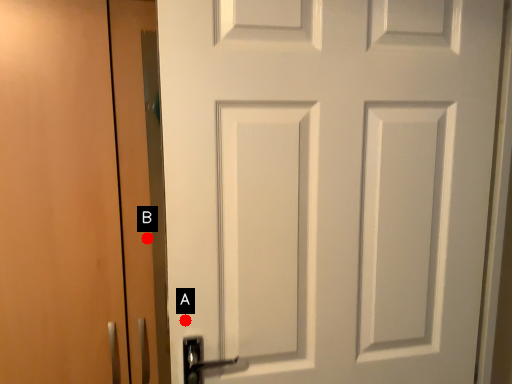
Question: Two points are circled on the image, labeled by A and B beside each circle. Which point is closer to the camera?

Choices:
 (A) A is closer
 (B) B is closer

Answer: (A)